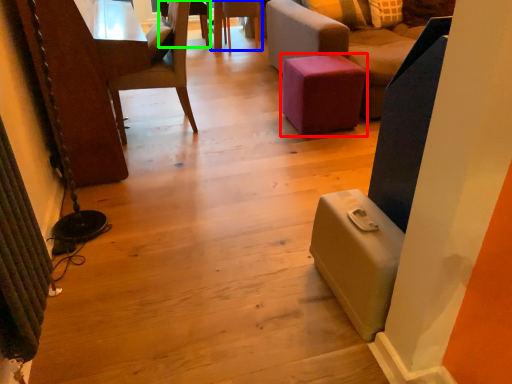
Question: Based on their relative distances, which object is farther from furniture (highlighted by a red box)? Choose from chair (highlighted by a blue box) and chair (highlighted by a green box).

Choices:
 (A) chair
 (B) chair

Answer: (B)